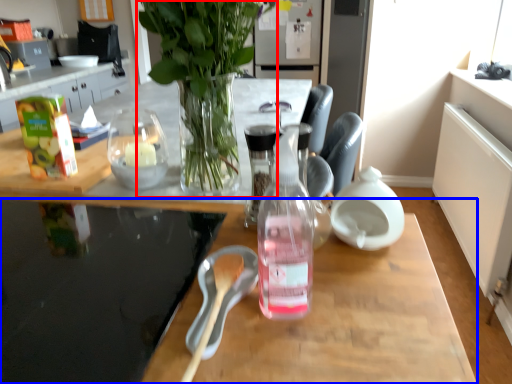
Question: Which object is closer to the camera taking this photo, houseplant (highlighted by a red box) or desk (highlighted by a blue box)?

Choices:
 (A) houseplant
 (B) desk

Answer: (B)